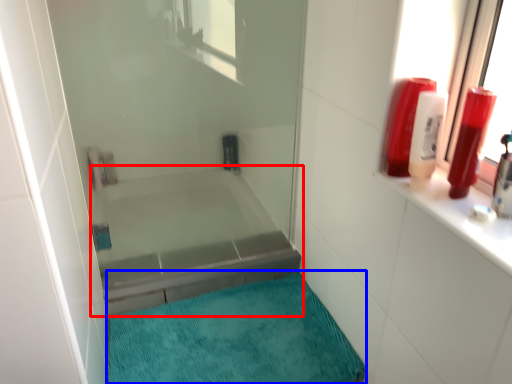
Question: Among these objects, which one is farthest to the camera, bathtub (highlighted by a red box) or bath mat (highlighted by a blue box)?

Choices:
 (A) bathtub
 (B) bath mat

Answer: (A)